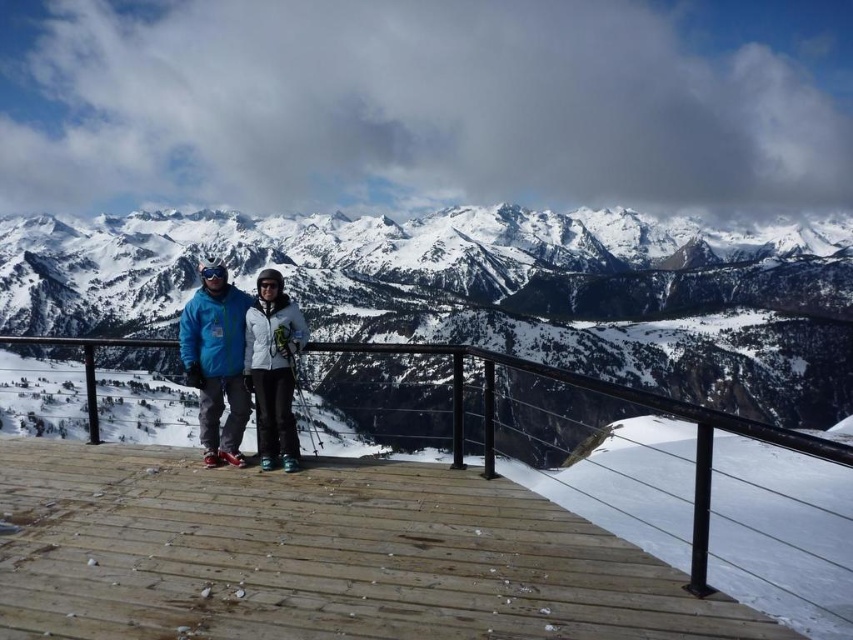
What is located at the coordinates point (323, 556) in the image?

The point (323, 556) indicates a black metal rail at center.